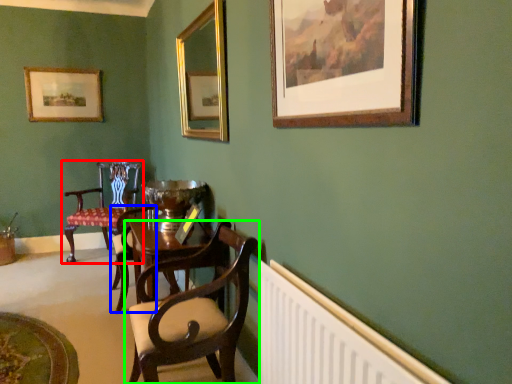
Question: Considering the real-world distances, which object is closest to chair (highlighted by a red box)? armchair (highlighted by a blue box) or chair (highlighted by a green box).

Choices:
 (A) armchair
 (B) chair

Answer: (A)